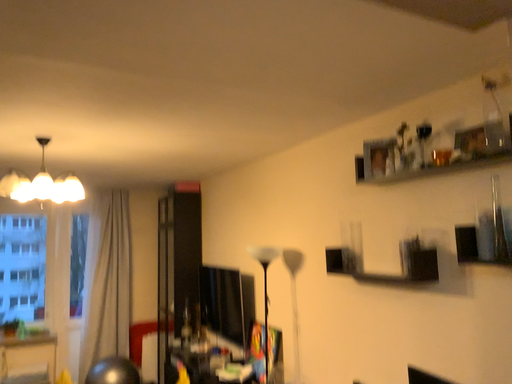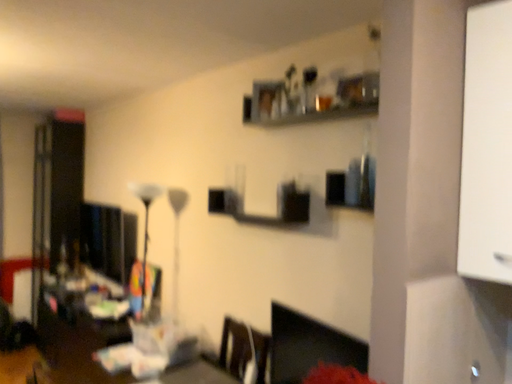
Question: Which way did the camera rotate in the video?

Choices:
 (A) rotated upward
 (B) rotated downward

Answer: (B)